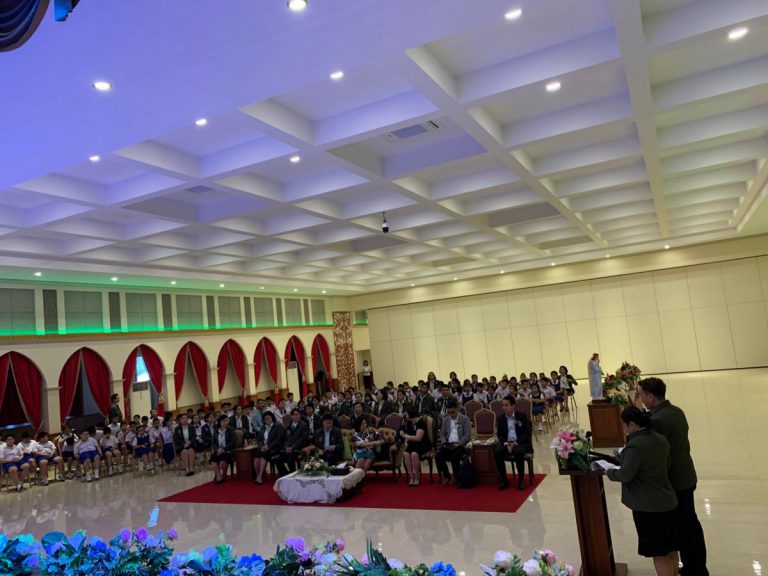
Locate an element on the screen. This screenshot has height=576, width=768. red curtains is located at coordinates (107, 391), (137, 360), (190, 360), (232, 361), (273, 361).